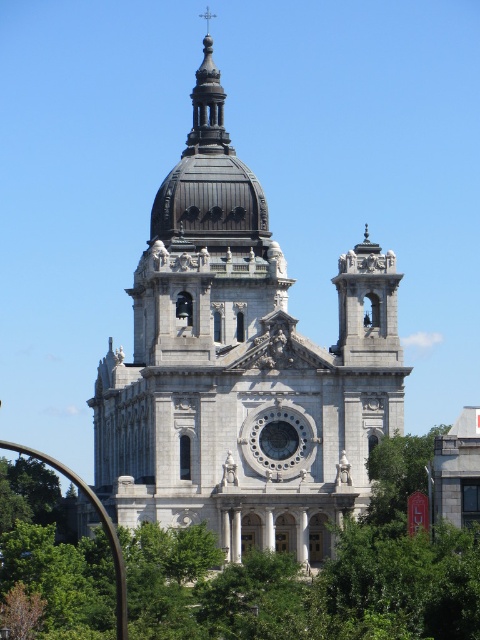
Can you confirm if white stone church at center is taller than green leafy tree at lower right?

Indeed, white stone church at center has a greater height compared to green leafy tree at lower right.

I want to click on white stone church at center, so click(241, 365).

Does point (288, 356) come closer to viewer compared to point (400, 461)?

No, it is not.

The image size is (480, 640). Identify the location of white stone church at center. (241, 365).

Which is in front, point (167, 634) or point (404, 515)?

Positioned in front is point (167, 634).

Locate an element on the screen. Image resolution: width=480 pixels, height=640 pixels. green leafy tree at center is located at coordinates (317, 576).

Does white stone church at center appear over green leafy tree at center?

Yes, white stone church at center is above green leafy tree at center.

Is white stone church at center to the right of green leafy tree at center from the viewer's perspective?

In fact, white stone church at center is to the left of green leafy tree at center.

Image resolution: width=480 pixels, height=640 pixels. What do you see at coordinates (241, 365) in the screenshot?
I see `white stone church at center` at bounding box center [241, 365].

You are a GUI agent. You are given a task and a screenshot of the screen. Output one action in this format:
    pyautogui.click(x=<x>, y=<y>)
    Task: Click on the white stone church at center
    This screenshot has height=640, width=480.
    Given the screenshot: What is the action you would take?
    pyautogui.click(x=241, y=365)